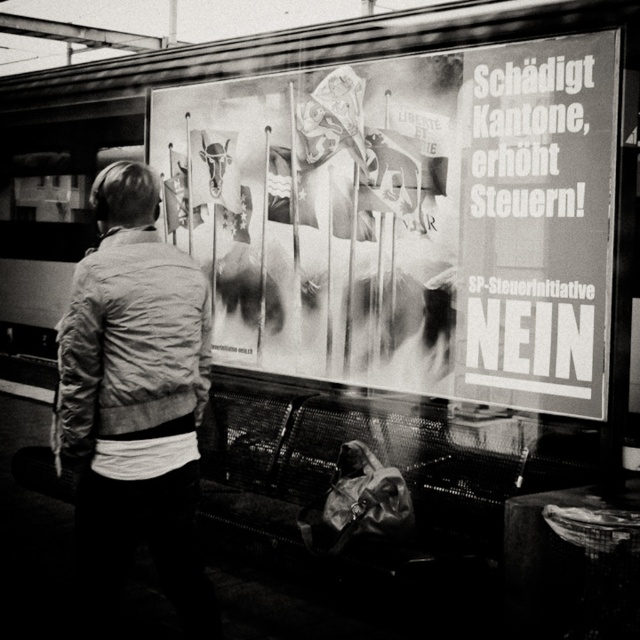
Question: Is black paper poster at center bigger than light gray jacket at center?

Choices:
 (A) yes
 (B) no

Answer: (A)

Question: Does black paper poster at center come behind light gray jacket at center?

Choices:
 (A) yes
 (B) no

Answer: (A)

Question: Considering the relative positions of black paper poster at center and light gray jacket at center in the image provided, where is black paper poster at center located with respect to light gray jacket at center?

Choices:
 (A) below
 (B) above

Answer: (B)

Question: Which point is closer to the camera taking this photo?

Choices:
 (A) (179, 426)
 (B) (232, 96)

Answer: (A)

Question: Which point is closer to the camera taking this photo?

Choices:
 (A) (192, 198)
 (B) (116, 608)

Answer: (B)